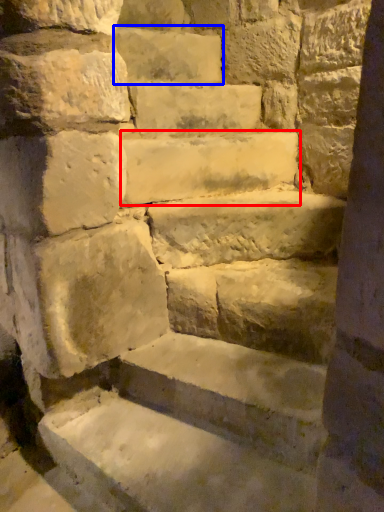
Question: Which object is closer to the camera taking this photo, stone (highlighted by a red box) or brick (highlighted by a blue box)?

Choices:
 (A) stone
 (B) brick

Answer: (A)